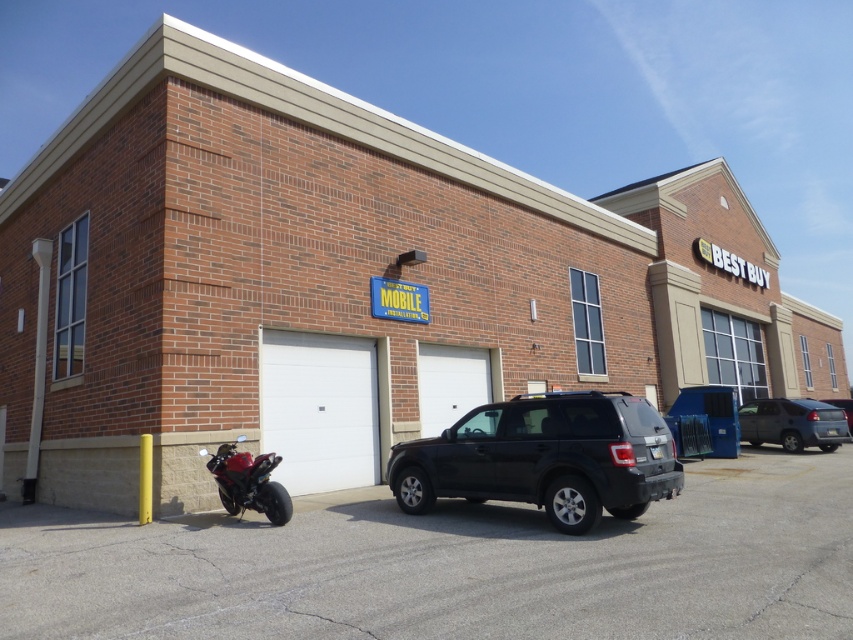
Can you confirm if smooth asphalt parking lot at lower center is thinner than dark gray matte suv at right?

No, smooth asphalt parking lot at lower center is not thinner than dark gray matte suv at right.

Identify the location of smooth asphalt parking lot at lower center. The width and height of the screenshot is (853, 640). (453, 564).

Does dark gray matte suv at right come behind shiny red motorcycle at lower left?

Yes.

Who is positioned more to the right, dark gray matte suv at right or shiny red motorcycle at lower left?

dark gray matte suv at right is more to the right.

Locate an element on the screen. The image size is (853, 640). dark gray matte suv at right is located at coordinates (792, 422).

Locate an element on the screen. dark gray matte suv at right is located at coordinates (792, 422).

Between smooth asphalt parking lot at lower center and black matte suv at center, which one has more height?

Standing taller between the two is black matte suv at center.

Can you confirm if smooth asphalt parking lot at lower center is taller than black matte suv at center?

No.

Does point (706, 582) come in front of point (415, 500)?

Yes, it is in front of point (415, 500).

What are the coordinates of `smooth asphalt parking lot at lower center` in the screenshot? It's located at (453, 564).